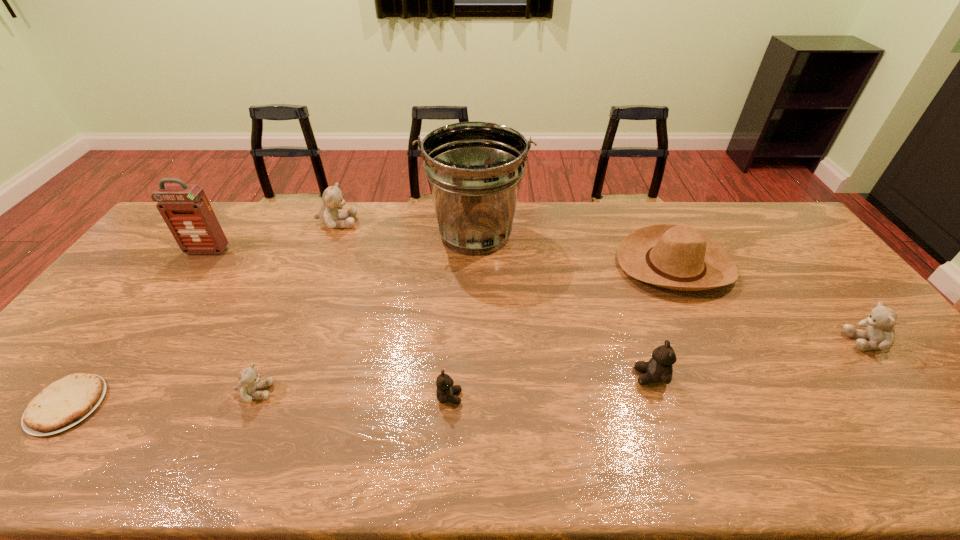
Image resolution: width=960 pixels, height=540 pixels. I want to click on free point between the bucket and the third teddy bear from left to right, so click(463, 315).

Find the location of a particular element. free space between the fifth farthest object and the brown cowboy hat is located at coordinates pyautogui.click(x=771, y=303).

What are the coordinates of `unoccupied area between the tallest teddy bear and the left brown teddy bear` in the screenshot? It's located at (394, 310).

Locate an element on the screen. The image size is (960, 540). vacant area that lies between the tortilla and the smaller brown teddy bear is located at coordinates (258, 401).

This screenshot has width=960, height=540. I want to click on free space between the rightmost teddy bear and the second tallest object, so click(x=538, y=296).

Image resolution: width=960 pixels, height=540 pixels. I want to click on blank region between the biggest gray teddy bear and the right brown teddy bear, so click(x=493, y=300).

You are a GUI agent. You are given a task and a screenshot of the screen. Output one action in this format:
    pyautogui.click(x=<x>, y=<y>)
    Task: Click on the unoccupied position between the nearest gray teddy bear and the tallest object
    
    Given the screenshot: What is the action you would take?
    (x=366, y=313)

The height and width of the screenshot is (540, 960). I want to click on free spot between the smallest gray teddy bear and the tallest teddy bear, so click(296, 307).

You are a GUI agent. You are given a task and a screenshot of the screen. Output one action in this format:
    pyautogui.click(x=<x>, y=<y>)
    Task: Click on the vacant space that's between the smaller brown teddy bear and the cowboy hat
    This screenshot has height=540, width=960.
    Given the screenshot: What is the action you would take?
    pyautogui.click(x=562, y=331)

You are a GUI agent. You are given a task and a screenshot of the screen. Output one action in this format:
    pyautogui.click(x=<x>, y=<y>)
    Task: Click on the object that stands as the seventh closest to the bigger brown teddy bear
    The width and height of the screenshot is (960, 540).
    Given the screenshot: What is the action you would take?
    pyautogui.click(x=64, y=403)